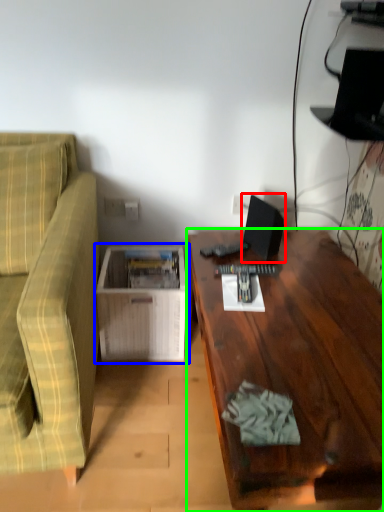
Question: Estimate the real-world distances between objects in this image. Which object is farther from computer monitor (highlighted by a red box), table (highlighted by a blue box) or desk (highlighted by a green box)?

Choices:
 (A) table
 (B) desk

Answer: (A)